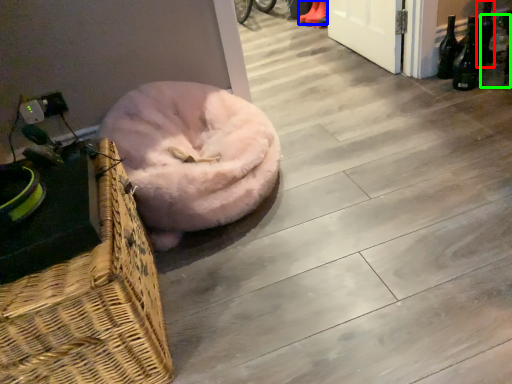
Question: Which is farther away from bottle (highlighted by a red box)? footwear (highlighted by a blue box) or bottle (highlighted by a green box)?

Choices:
 (A) footwear
 (B) bottle

Answer: (A)